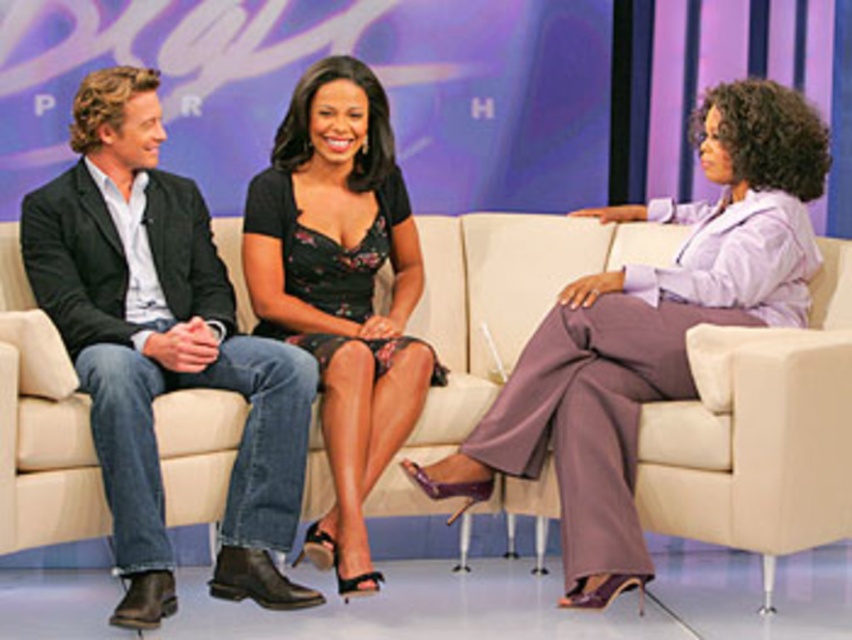
Between point (724, 445) and point (239, 451), which one is positioned in front?

Point (724, 445) is in front.

Measure the distance between beige fabric couch at center and camera.

beige fabric couch at center is 3.53 meters from camera.

This screenshot has width=852, height=640. Find the location of `beige fabric couch at center`. beige fabric couch at center is located at coordinates (758, 433).

Between purple satin pants at right and black floral dress at center, which one has less height?

Standing shorter between the two is purple satin pants at right.

Is point (772, 259) closer to camera compared to point (292, 211)?

Yes, it is.

The width and height of the screenshot is (852, 640). What do you see at coordinates (649, 332) in the screenshot? I see `purple satin pants at right` at bounding box center [649, 332].

What are the coordinates of `purple satin pants at right` in the screenshot? It's located at (649, 332).

Who is positioned more to the left, denim jeans at left or black floral dress at center?

From the viewer's perspective, denim jeans at left appears more on the left side.

Between point (50, 301) and point (367, 188), which one is positioned in front?

Point (50, 301) is in front.

Does point (141, 128) come closer to viewer compared to point (315, 225)?

Yes, it is in front of point (315, 225).

Find the location of a particular element. This screenshot has width=852, height=640. denim jeans at left is located at coordinates (162, 348).